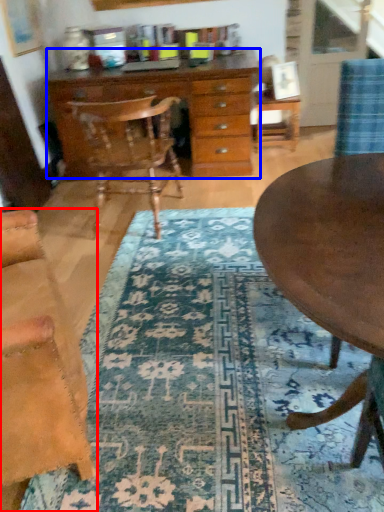
Question: Which point is closer to the camera, chair (highlighted by a red box) or chest of drawers (highlighted by a blue box)?

Choices:
 (A) chair
 (B) chest of drawers

Answer: (A)